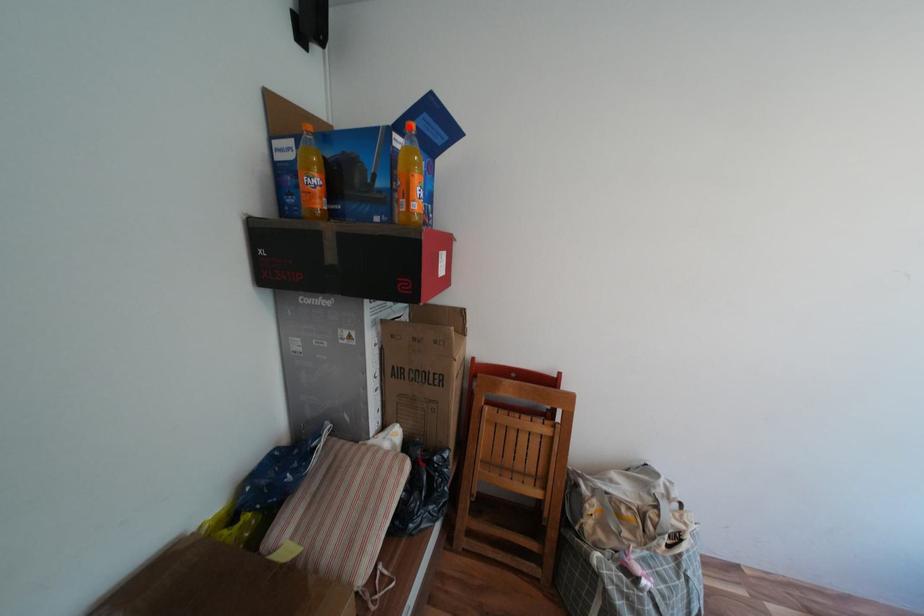
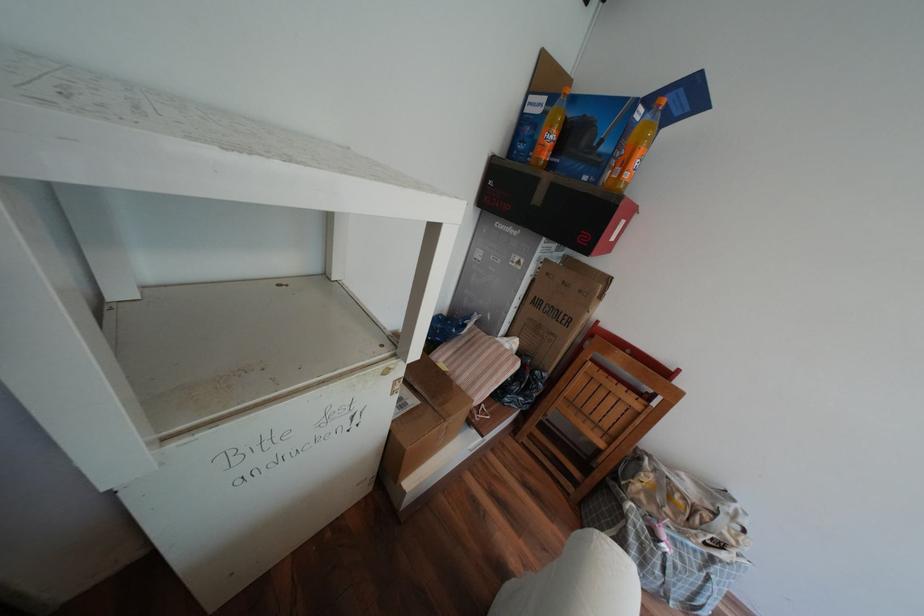
In the second image, find the point that corresponds to the highlighted location in the first image.

(659, 100)